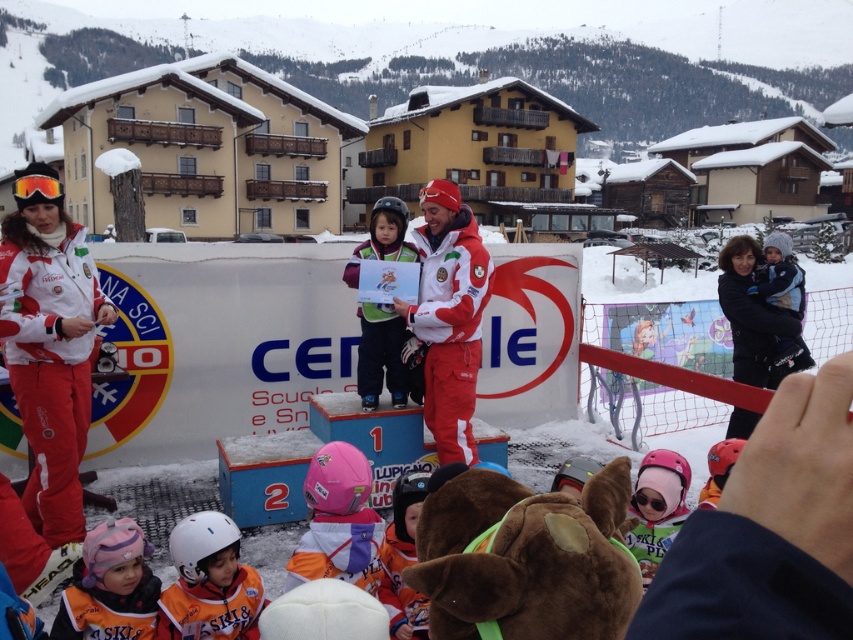
Who is positioned more to the right, matte red jacket at center or pink matte helmet at center?

Positioned to the right is pink matte helmet at center.

Who is more forward, (490, 260) or (677, 509)?

Positioned in front is point (677, 509).

Between point (454, 392) and point (653, 560), which one is positioned in front?

Point (653, 560)

Where is `matte red jacket at center`? The height and width of the screenshot is (640, 853). matte red jacket at center is located at coordinates (450, 316).

Does matte red jacket at center have a smaller size compared to green fabric jacket at center?

Incorrect, matte red jacket at center is not smaller in size than green fabric jacket at center.

Between matte red jacket at center and green fabric jacket at center, which one has less height?

green fabric jacket at center

Between point (466, 262) and point (358, 312), which one is positioned behind?

The point (358, 312) is more distant.

Where is `matte red jacket at center`? matte red jacket at center is located at coordinates (450, 316).

Can you confirm if pink fleece hat at lower left is thinner than pink matte helmet at center?

Incorrect, pink fleece hat at lower left's width is not less than pink matte helmet at center's.

Who is taller, pink fleece hat at lower left or pink matte helmet at center?

With more height is pink matte helmet at center.

Does point (119, 632) come behind point (654, 522)?

No.

I want to click on pink fleece hat at lower left, so click(x=109, y=588).